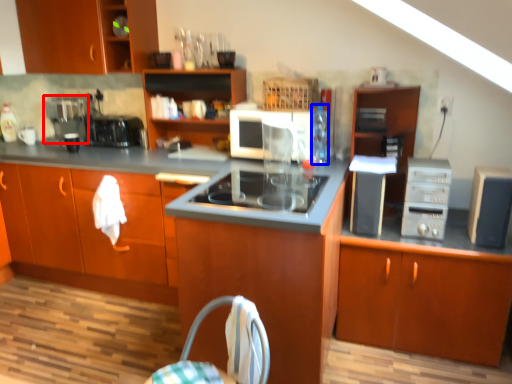
Question: Among these objects, which one is nearest to the camera, coffee machine (highlighted by a red box) or bottle (highlighted by a blue box)?

Choices:
 (A) coffee machine
 (B) bottle

Answer: (B)